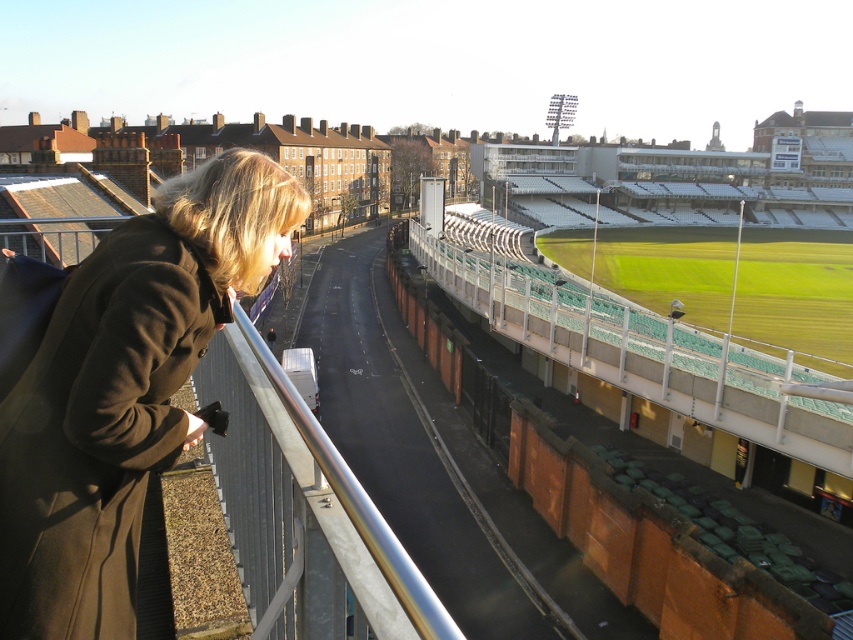
You are standing on the elevated vantage point overlooking the sports stadium. You see the matte brown coat at left and the silver metallic railing at center. Which object is closer to you?

The matte brown coat at left is closer to you because the silver metallic railing at center is behind it.

You are a photographer trying to capture the entire scene of the stadium from this vantage point. Considering the matte brown coat at left and the silver metallic railing at center, which object would you need to adjust your camera angle to include more of the background stadium seats?

The matte brown coat at left occupies less space than the silver metallic railing at center, so adjusting the camera angle to account for the larger silver metallic railing at center would allow more of the background stadium seats to be visible.